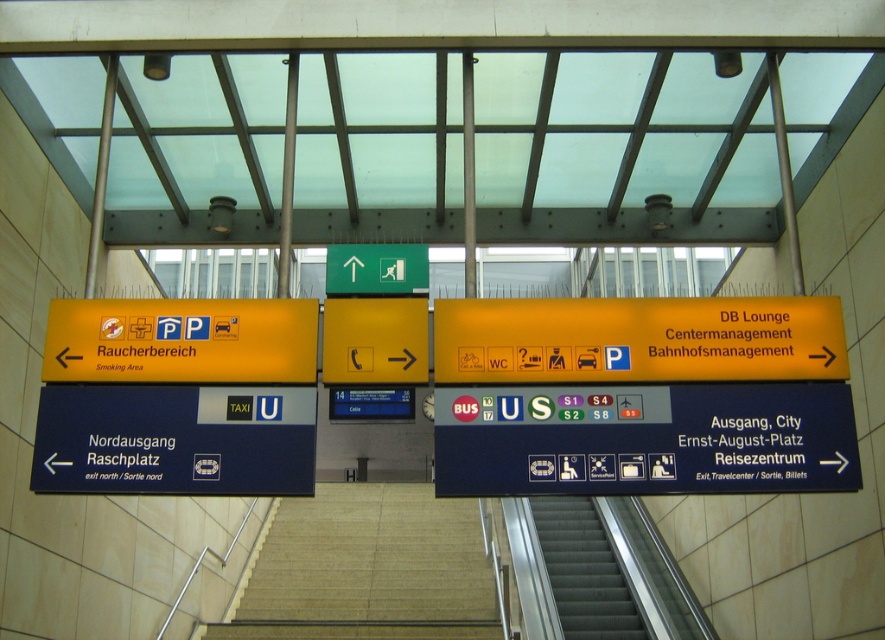
Question: Does metallic gray stairs at center appear on the right side of yellow matte phone at center?

Choices:
 (A) no
 (B) yes

Answer: (B)

Question: Which point is closer to the camera taking this photo?

Choices:
 (A) (394, 621)
 (B) (387, 273)

Answer: (B)

Question: Observing the image, what is the correct spatial positioning of metallic gray stairs at center in reference to yellow matte phone at center?

Choices:
 (A) left
 (B) right

Answer: (B)

Question: Does blue matte sign at right have a larger size compared to beige carpeted stairs at center?

Choices:
 (A) yes
 (B) no

Answer: (B)

Question: Estimate the real-world distances between objects in this image. Which object is farther from the yellow matte sign at left?

Choices:
 (A) beige carpeted stairs at center
 (B) green matte sign at upper center
 (C) yellow matte phone at center

Answer: (A)

Question: Which point is closer to the camera taking this photo?

Choices:
 (A) (324, 378)
 (B) (260, 477)

Answer: (B)